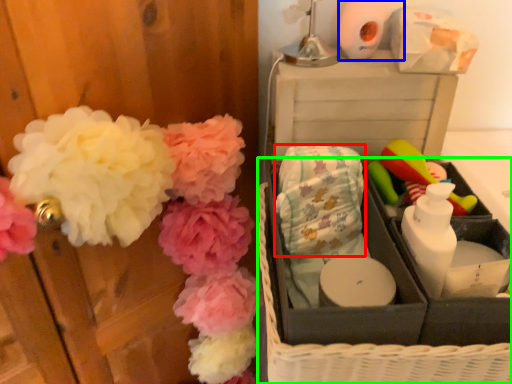
Question: Considering the real-world distances, which object is closest to material (highlighted by a red box)? toilet paper (highlighted by a blue box) or basket (highlighted by a green box).

Choices:
 (A) toilet paper
 (B) basket

Answer: (B)